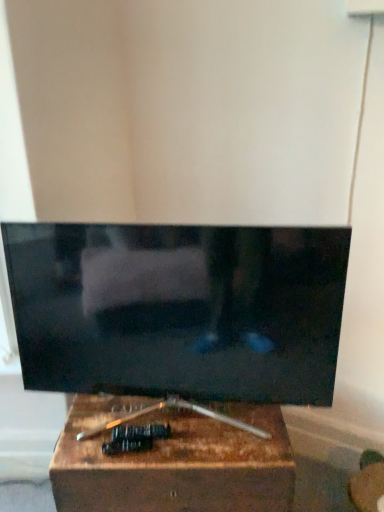
Describe the element at coordinates (174, 462) in the screenshot. I see `wooden box at center` at that location.

The height and width of the screenshot is (512, 384). I want to click on wooden box at center, so click(174, 462).

Find the location of a particular element. This screenshot has width=384, height=512. matte black tv at center is located at coordinates (179, 309).

What do you see at coordinates (179, 309) in the screenshot? I see `matte black tv at center` at bounding box center [179, 309].

Image resolution: width=384 pixels, height=512 pixels. I want to click on wooden box at center, so click(x=174, y=462).

Considering the relative positions of matte black tv at center and wooden box at center in the image provided, is matte black tv at center to the right of wooden box at center from the viewer's perspective?

No, matte black tv at center is not to the right of wooden box at center.

Relative to wooden box at center, is matte black tv at center in front or behind?

Clearly, matte black tv at center is in front of wooden box at center.

Does point (213, 353) come farther from viewer compared to point (252, 483)?

That is True.

From the image's perspective, relative to wooden box at center, is matte black tv at center above or below?

Clearly, from the image's perspective, matte black tv at center is above wooden box at center.

From a real-world perspective, who is located lower, matte black tv at center or wooden box at center?

From a 3D spatial view, wooden box at center is below.

Can you confirm if matte black tv at center is thinner than wooden box at center?

Correct, the width of matte black tv at center is less than that of wooden box at center.

Is matte black tv at center shorter than wooden box at center?

No.

Considering the relative sizes of matte black tv at center and wooden box at center in the image provided, is matte black tv at center smaller than wooden box at center?

Correct, matte black tv at center occupies less space than wooden box at center.

Can wooden box at center be found inside matte black tv at center?

No, wooden box at center is located outside of matte black tv at center.

Based on the photo, is there a large distance between matte black tv at center and wooden box at center?

matte black tv at center is actually quite close to wooden box at center.

Is matte black tv at center looking in the opposite direction of wooden box at center?

No, matte black tv at center is not facing the opposite direction of wooden box at center.

How many degrees apart are the facing directions of matte black tv at center and wooden box at center?

2.65 degrees.

The image size is (384, 512). I want to click on furniture on the right of matte black tv at center, so click(174, 462).

Consider the image. Which is more to the left, wooden box at center or matte black tv at center?

matte black tv at center is more to the left.

Is wooden box at center further to camera compared to matte black tv at center?

Yes, wooden box at center is further from the camera.

Does point (167, 487) come farther from viewer compared to point (254, 300)?

That is True.

From the image's perspective, between wooden box at center and matte black tv at center, which one is located above?

matte black tv at center is shown above in the image.

From a real-world perspective, is wooden box at center over matte black tv at center?

Incorrect, from a real-world perspective, wooden box at center is lower than matte black tv at center.

Can you confirm if wooden box at center is thinner than matte black tv at center?

No.

Considering the sizes of objects wooden box at center and matte black tv at center in the image provided, who is taller, wooden box at center or matte black tv at center?

matte black tv at center is taller.

Is wooden box at center bigger than matte black tv at center?

Yes, wooden box at center is bigger than matte black tv at center.

Is matte black tv at center completely or partially inside wooden box at center?

No.

Is wooden box at center next to matte black tv at center and touching it?

There is a gap between wooden box at center and matte black tv at center.

From the picture: Is wooden box at center facing towards matte black tv at center?

No, wooden box at center is not turned towards matte black tv at center.

How far apart are wooden box at center and matte black tv at center?

10.61 inches.

Where is `furniture that is under the matte black tv at center (from a real-world perspective)`? The height and width of the screenshot is (512, 384). furniture that is under the matte black tv at center (from a real-world perspective) is located at coordinates (x=174, y=462).

Where is `furniture below the matte black tv at center (from the image's perspective)`? The width and height of the screenshot is (384, 512). furniture below the matte black tv at center (from the image's perspective) is located at coordinates (174, 462).

This screenshot has height=512, width=384. In order to click on furniture beneath the matte black tv at center (from a real-world perspective) in this screenshot , I will do `click(174, 462)`.